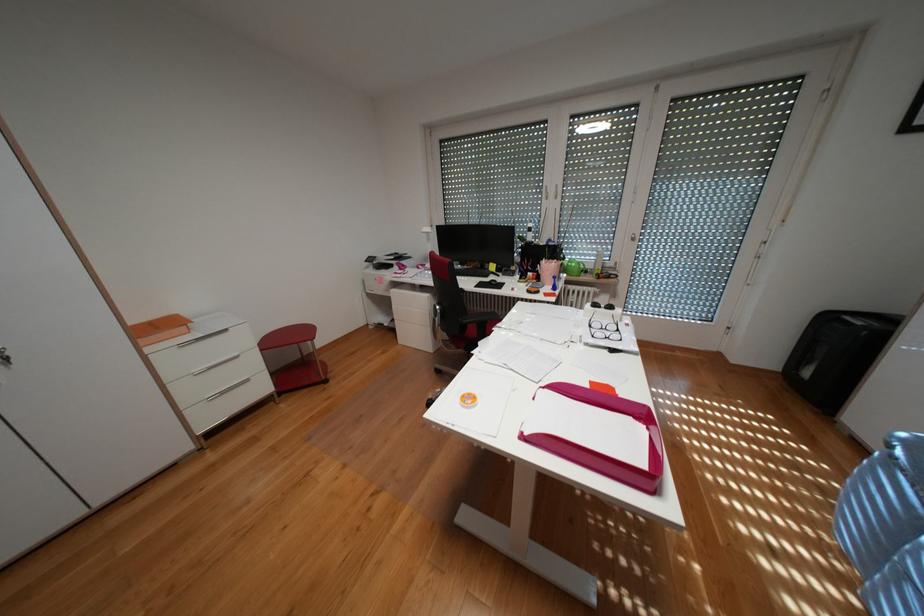
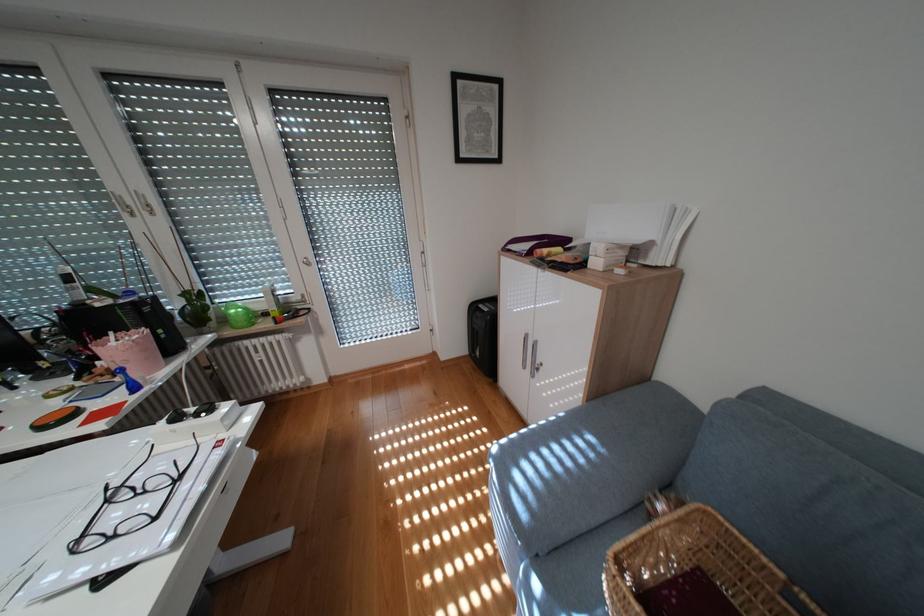
In the second image, find the point that corresponds to (602,325) in the first image.

(119, 501)